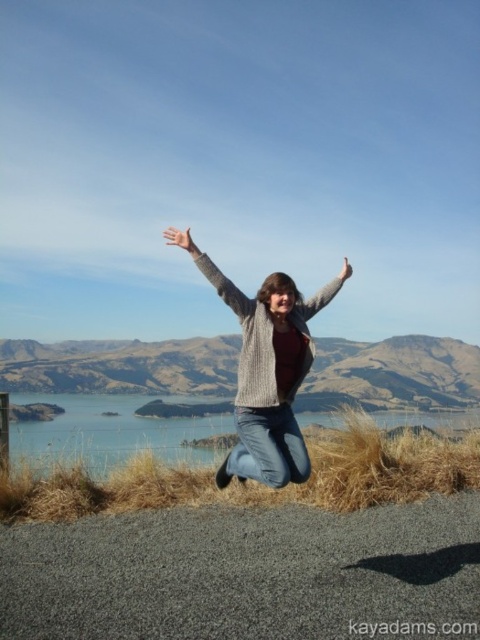
You are a photographer trying to capture the perfect shot of the knitted sweater at center. The sweater is positioned at coordinates 0.578 on the x axis and 0.556 on the y axis. If your camera frame has a width of 0.6 and a height of 0.6, will the sweater fit entirely within the frame?

The knitted sweater at center is located at point (266, 369). Given the camera frame has a width and height of 0.6, the sweater will fit within the frame as its position is centered within the frame dimensions.

You are standing at the point labeled as point (108, 432). What is located at this point?

The blue water at center is located at point (108, 432).

You are a fashion designer analyzing the image of a person wearing a knitted sweater at center and a gray woolen sweater at upper center. Which sweater is positioned higher on the person?

The gray woolen sweater at upper center is positioned higher than the knitted sweater at center, as it is located above it.